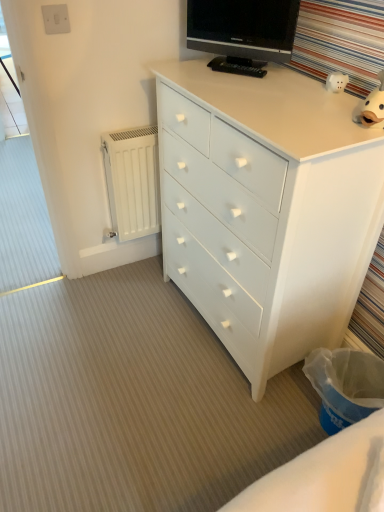
Question: Considering the relative sizes of white matte radiator at lower left and white plastic switch at upper left in the image provided, is white matte radiator at lower left bigger than white plastic switch at upper left?

Choices:
 (A) no
 (B) yes

Answer: (B)

Question: Can you confirm if white matte radiator at lower left is smaller than white plastic switch at upper left?

Choices:
 (A) no
 (B) yes

Answer: (A)

Question: Considering the relative positions of white matte radiator at lower left and white plastic switch at upper left in the image provided, is white matte radiator at lower left behind white plastic switch at upper left?

Choices:
 (A) yes
 (B) no

Answer: (A)

Question: Does white matte radiator at lower left have a greater height compared to white plastic switch at upper left?

Choices:
 (A) yes
 (B) no

Answer: (A)

Question: Is white matte radiator at lower left wider than white plastic switch at upper left?

Choices:
 (A) yes
 (B) no

Answer: (A)

Question: Is white matte radiator at lower left to the left of white plastic switch at upper left from the viewer's perspective?

Choices:
 (A) yes
 (B) no

Answer: (B)

Question: From a real-world perspective, does black glossy tv at upper center sit lower than white matte radiator at lower left?

Choices:
 (A) yes
 (B) no

Answer: (B)

Question: Considering the relative positions of black glossy tv at upper center and white matte radiator at lower left in the image provided, is black glossy tv at upper center to the left of white matte radiator at lower left from the viewer's perspective?

Choices:
 (A) no
 (B) yes

Answer: (A)

Question: Is black glossy tv at upper center shorter than white matte radiator at lower left?

Choices:
 (A) yes
 (B) no

Answer: (A)

Question: From the image's perspective, is black glossy tv at upper center located above white matte radiator at lower left?

Choices:
 (A) no
 (B) yes

Answer: (B)

Question: Is black glossy tv at upper center at the right side of white matte radiator at lower left?

Choices:
 (A) no
 (B) yes

Answer: (B)

Question: Is white matte radiator at lower left inside black glossy tv at upper center?

Choices:
 (A) no
 (B) yes

Answer: (A)

Question: Considering the relative positions of white painted wood chest of drawers at center and white plastic switch at upper left in the image provided, is white painted wood chest of drawers at center in front of white plastic switch at upper left?

Choices:
 (A) no
 (B) yes

Answer: (B)